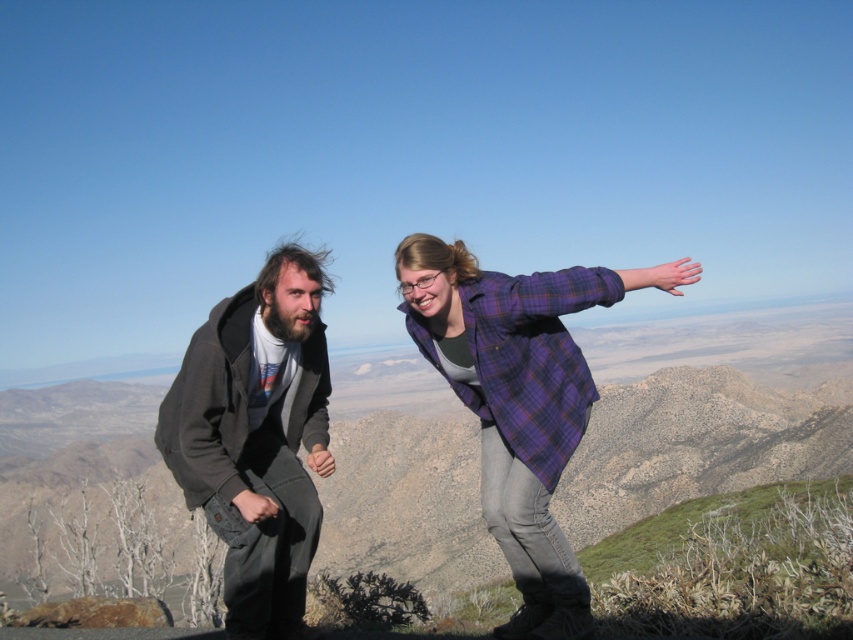
Between purple flannel shirt at center and dark gray hoodie at left, which one appears on the right side from the viewer's perspective?

Positioned to the right is purple flannel shirt at center.

The height and width of the screenshot is (640, 853). What do you see at coordinates (519, 401) in the screenshot? I see `purple flannel shirt at center` at bounding box center [519, 401].

Locate an element on the screen. This screenshot has width=853, height=640. purple flannel shirt at center is located at coordinates (519, 401).